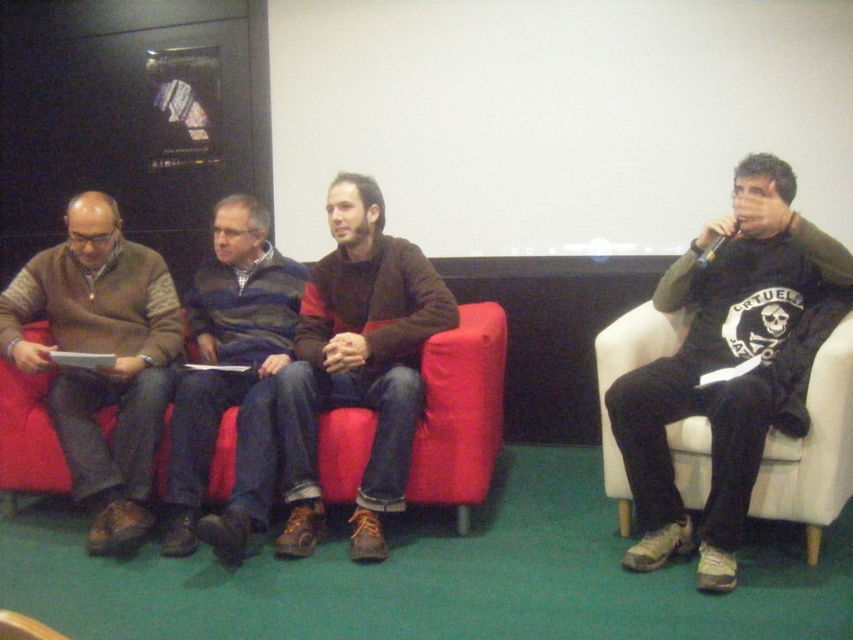
Which of these two, matte brown sweater at left or blue striped sweater at center, stands taller?

blue striped sweater at center

Does matte brown sweater at left have a larger size compared to blue striped sweater at center?

Indeed, matte brown sweater at left has a larger size compared to blue striped sweater at center.

Does point (117, 476) come farther from viewer compared to point (187, 515)?

No, (117, 476) is closer to viewer.

I want to click on matte brown sweater at left, so click(100, 365).

Locate an element on the screen. This screenshot has width=853, height=640. black matte shirt at right is located at coordinates (720, 365).

Who is positioned more to the left, black matte shirt at right or blue striped sweater at center?

Positioned to the left is blue striped sweater at center.

Locate an element on the screen. This screenshot has height=640, width=853. black matte shirt at right is located at coordinates (720, 365).

Is black matte shirt at right positioned before matte brown sweater at left?

Yes, black matte shirt at right is in front of matte brown sweater at left.

Is black matte shirt at right smaller than matte brown sweater at left?

Incorrect, black matte shirt at right is not smaller in size than matte brown sweater at left.

Is point (718, 298) closer to camera compared to point (74, 484)?

No, (718, 298) is further to viewer.

Where is `black matte shirt at right`? This screenshot has height=640, width=853. black matte shirt at right is located at coordinates (720, 365).